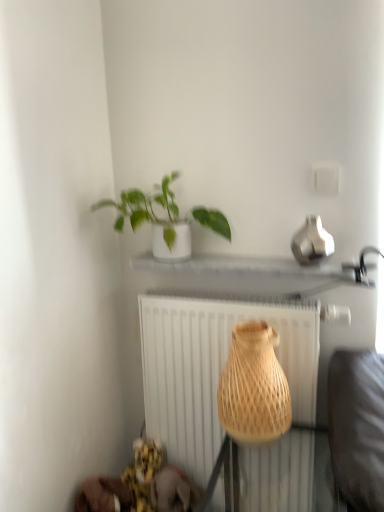
Question: From a real-world perspective, is green matte plant at upper center positioned above or below white textured radiator at center?

Choices:
 (A) below
 (B) above

Answer: (B)

Question: Looking at the image, does green matte plant at upper center seem bigger or smaller compared to white textured radiator at center?

Choices:
 (A) big
 (B) small

Answer: (B)

Question: Which of these objects is positioned closest to the white textured radiator at center?

Choices:
 (A) green matte plant at upper center
 (B) natural woven vase at center

Answer: (B)

Question: Which object is positioned farthest from the white textured radiator at center?

Choices:
 (A) green matte plant at upper center
 (B) natural woven vase at center

Answer: (A)